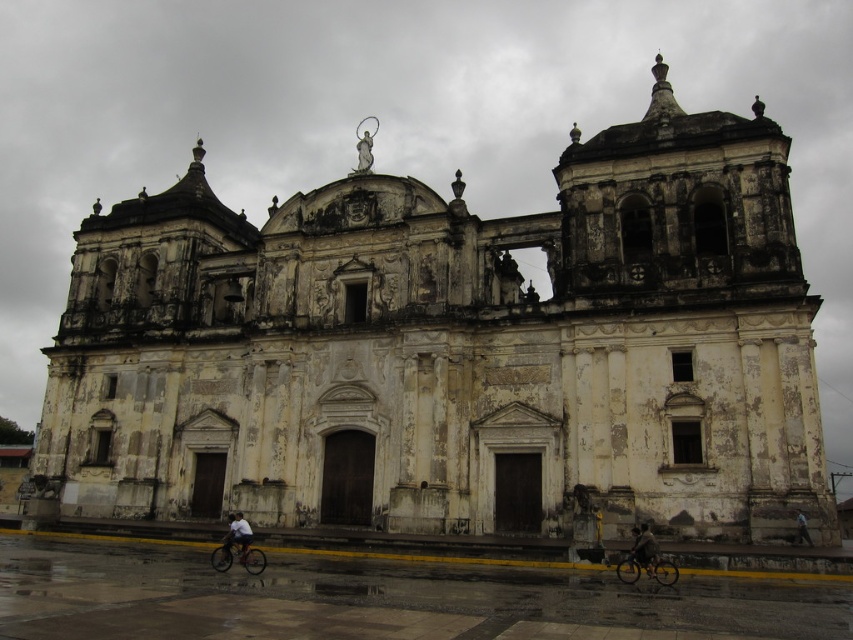
Can you confirm if silver metallic bicycle at lower center is wider than light blue shirt at center?

Yes, silver metallic bicycle at lower center is wider than light blue shirt at center.

Does point (233, 554) lie in front of point (245, 541)?

That is False.

Between point (262, 563) and point (227, 550), which one is positioned in front?

Point (227, 550) is in front.

Where is `silver metallic bicycle at lower center`? The width and height of the screenshot is (853, 640). silver metallic bicycle at lower center is located at coordinates (236, 556).

Describe the element at coordinates (643, 548) in the screenshot. The image size is (853, 640). I see `dark gray fabric jacket at lower right` at that location.

Can you confirm if dark gray fabric jacket at lower right is bigger than light blue shirt at center?

Incorrect, dark gray fabric jacket at lower right is not larger than light blue shirt at center.

Which is behind, point (642, 538) or point (247, 522)?

Positioned behind is point (247, 522).

Identify the location of dark gray fabric jacket at lower right. This screenshot has height=640, width=853. (643, 548).

Does shiny metallic bicycle at lower right have a lesser width compared to light blue shirt at center?

Yes, shiny metallic bicycle at lower right is thinner than light blue shirt at center.

Who is more distant from viewer, [672,572] or [244,538]?

The point [244,538] is more distant.

Which is behind, point (666, 564) or point (236, 538)?

The point (236, 538) is more distant.

Locate an element on the screen. shiny metallic bicycle at lower right is located at coordinates (646, 570).